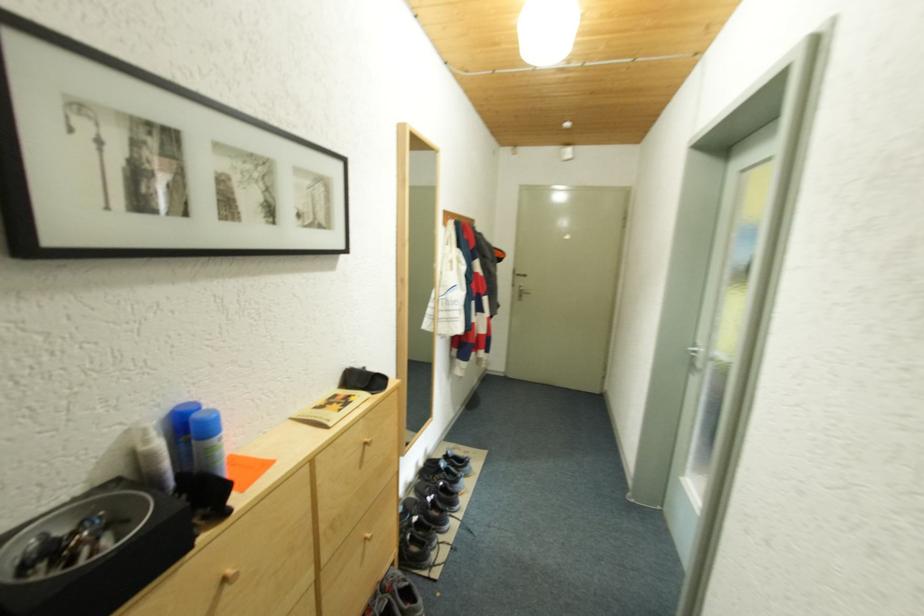
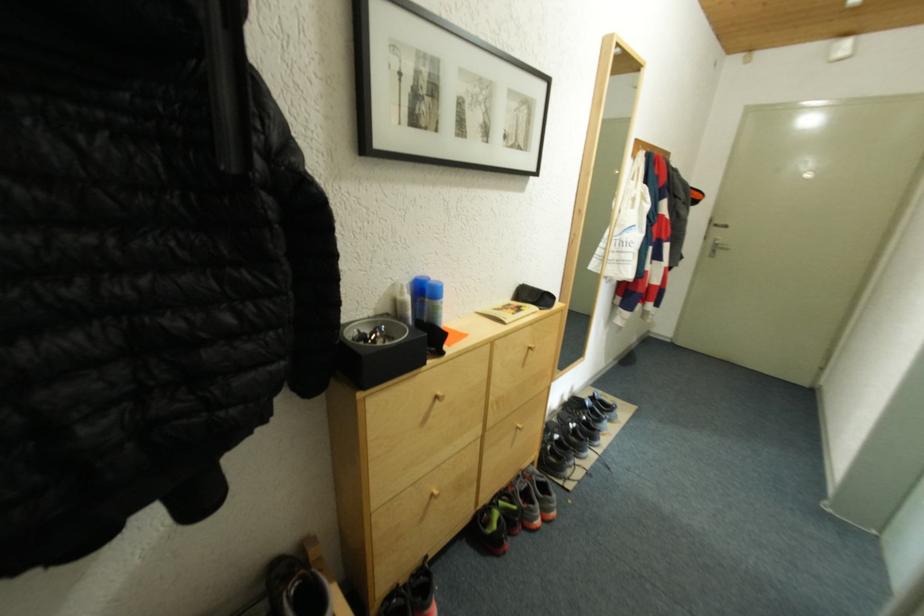
Question: Based on the continuous images, in which direction is the camera rotating? Reply with the corresponding letter.

Choices:
 (A) Left
 (B) Right
 (C) Up
 (D) Down

Answer: (A)